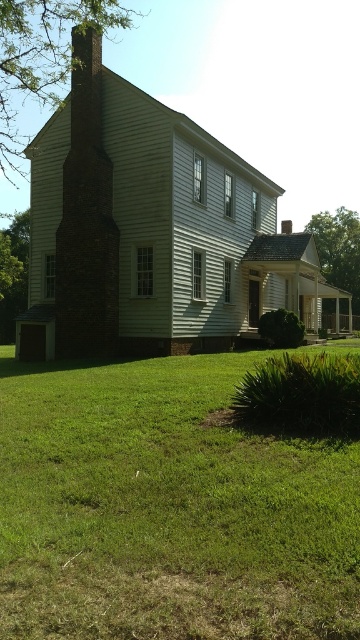
You are standing in front of the house and want to walk towards the brick chimney at left. Which direction should you move relative to the green grass at lower center?

To reach the brick chimney at left, you should move to the left side of the green grass at lower center since the green grass at lower center is positioned on the right side of brick chimney at left.